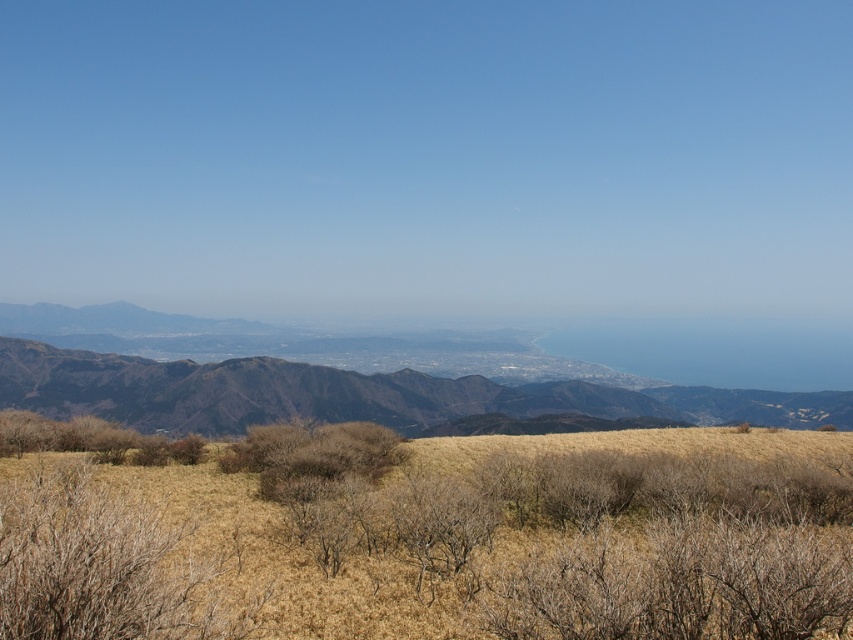
You are standing in the middle of the dry, grassy field shown in the image. There is a point marked at coordinates (444,544) which corresponds to dry grass at center. Can you walk directly towards that point without encountering any obstacles?

Yes, you can walk directly towards the point marked at coordinates (444,544) because it is located in the dry grass at center, which is part of the open landscape with no obstacles mentioned in the scene description.